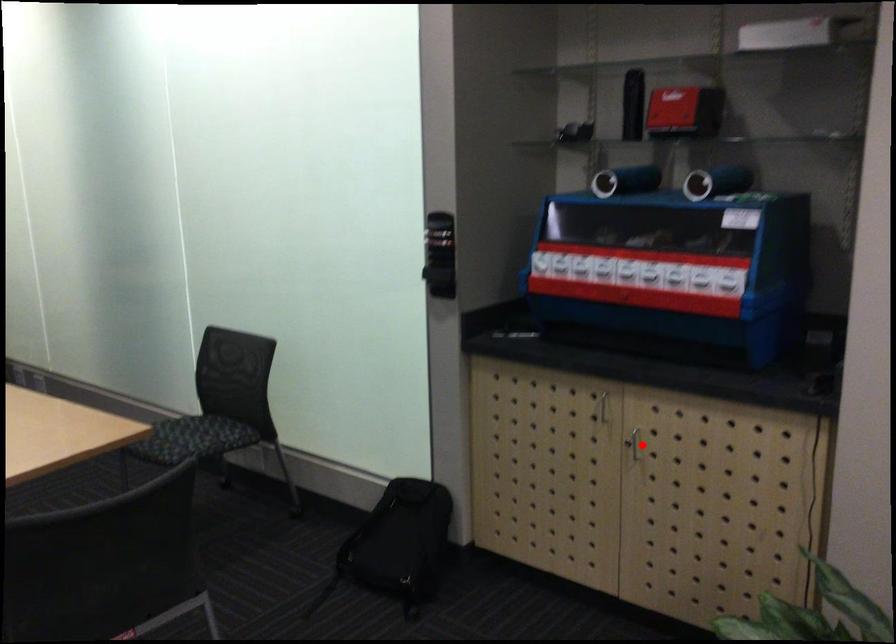
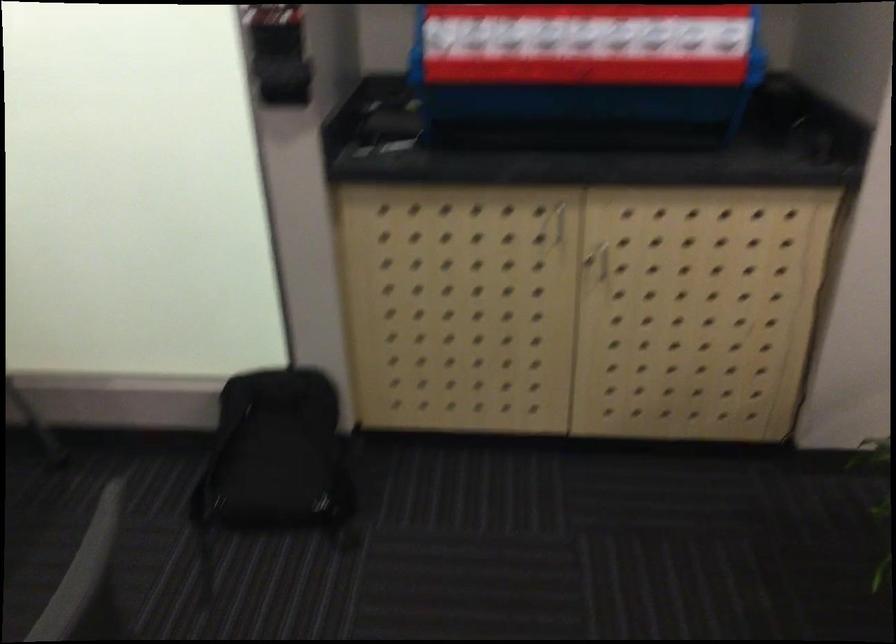
Where in the second image is the point corresponding to the highlighted location from the first image?

(604, 261)